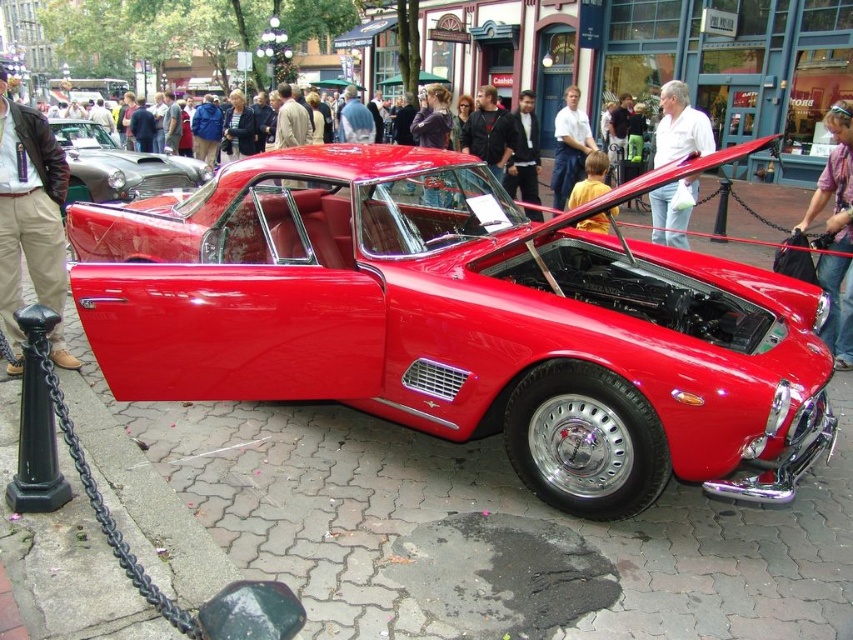
You are a photographer standing behind the khaki cotton pants at left, wanting to take a photo of the shiny metallic car at left. If your camera has a maximum focus range of 20 feet, will you be able to capture the car in focus without moving closer?

The khaki cotton pants at left is 20.17 feet from the shiny metallic car at left. Since the distance is slightly over the camera maximum focus range of 20 feet, you will not be able to capture the car in focus without moving closer.

You are a photographer trying to capture the shiny red car at center and the khaki cotton pants at left in the same frame. Based on their heights, which object should you focus on first to ensure both are in focus?

The shiny red car at center is much taller than the khaki cotton pants at left, so you should focus on the shiny red car at center first to ensure both are in focus.